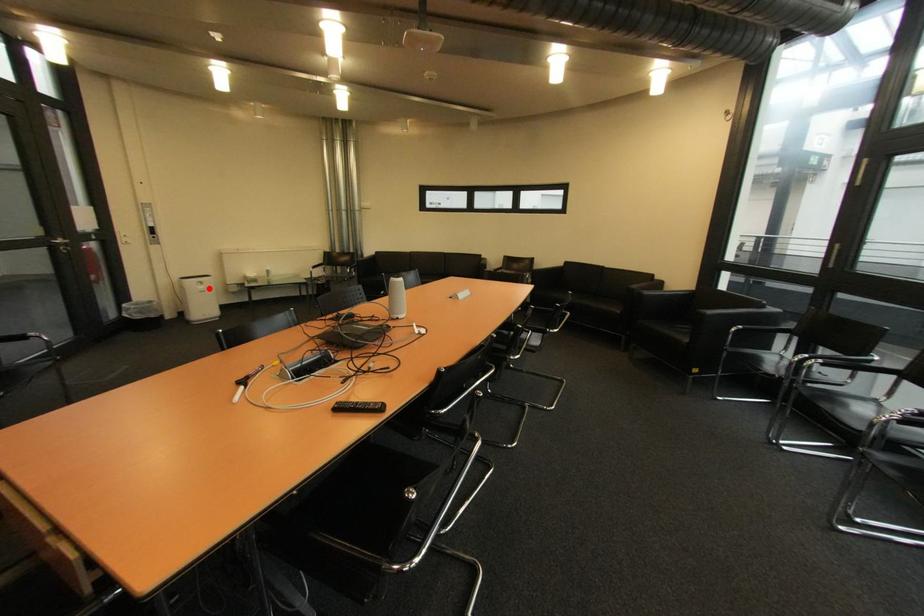
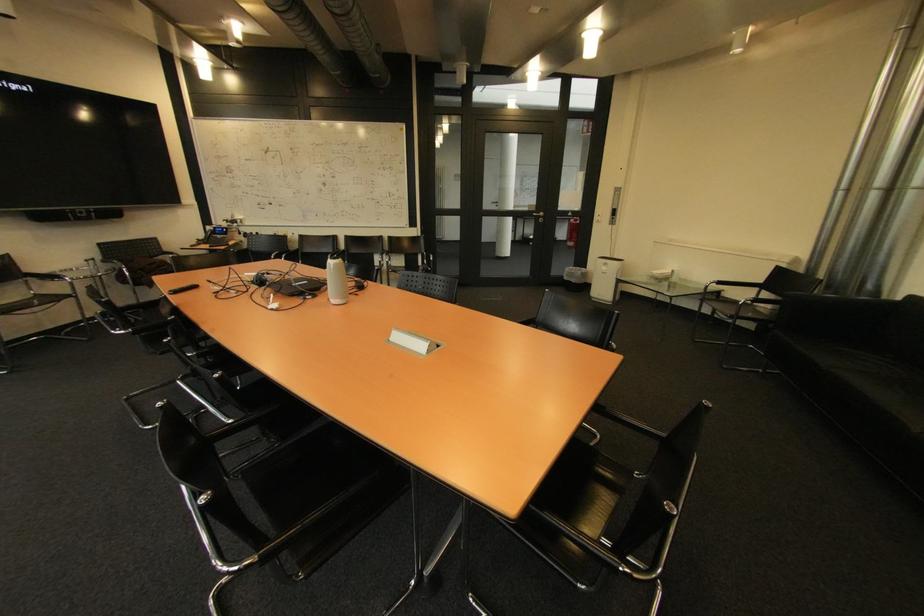
Locate, in the second image, the point that corresponds to the highlighted location in the first image.

(613, 270)